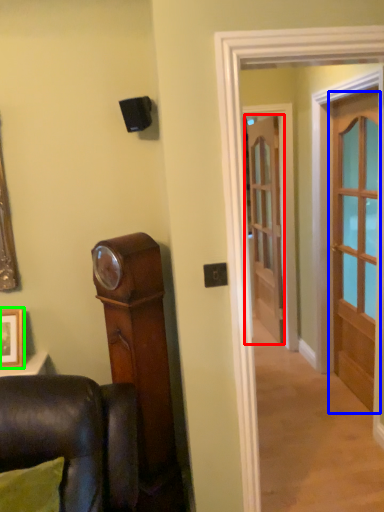
Question: Which is farther away from door (highlighted by a red box)? door (highlighted by a blue box) or picture frame (highlighted by a green box)?

Choices:
 (A) door
 (B) picture frame

Answer: (B)